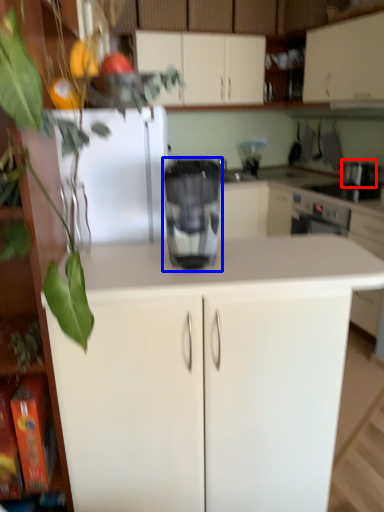
Question: Which of the following is the farthest to the observer, appliance (highlighted by a red box) or home appliance (highlighted by a blue box)?

Choices:
 (A) appliance
 (B) home appliance

Answer: (A)